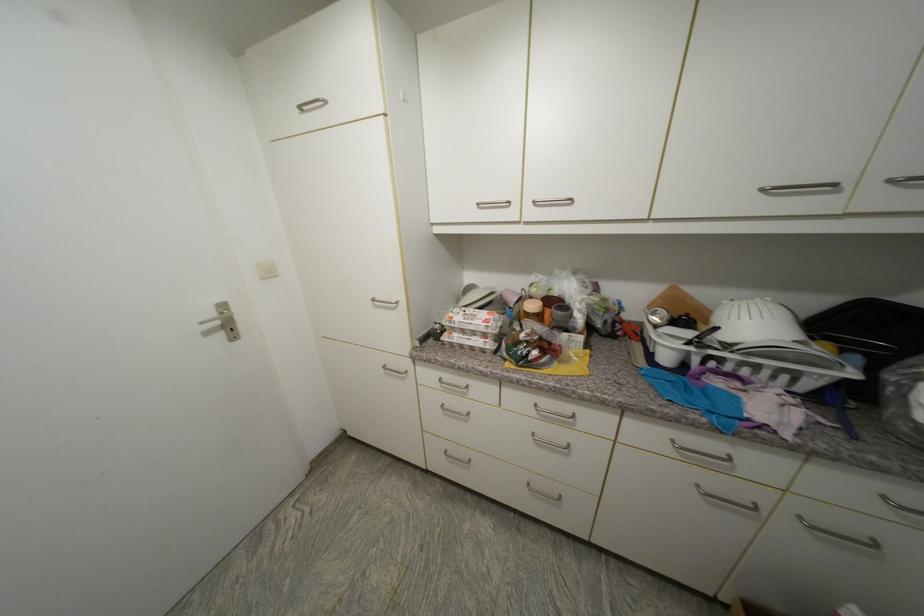
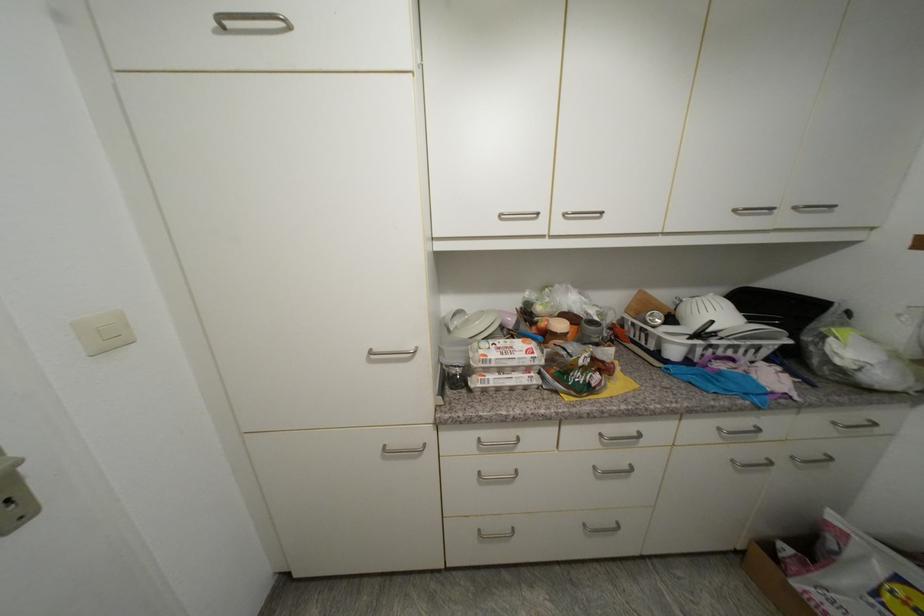
Locate, in the second image, the point that corresponds to point (457, 318) in the first image.

(492, 357)